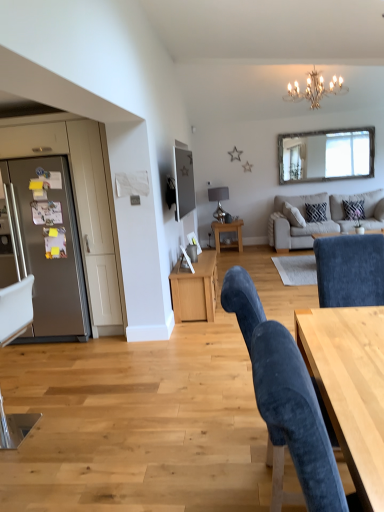
Identify the location of free spot above light wood desk at lower right (from a real-world perspective). The height and width of the screenshot is (512, 384). (352, 356).